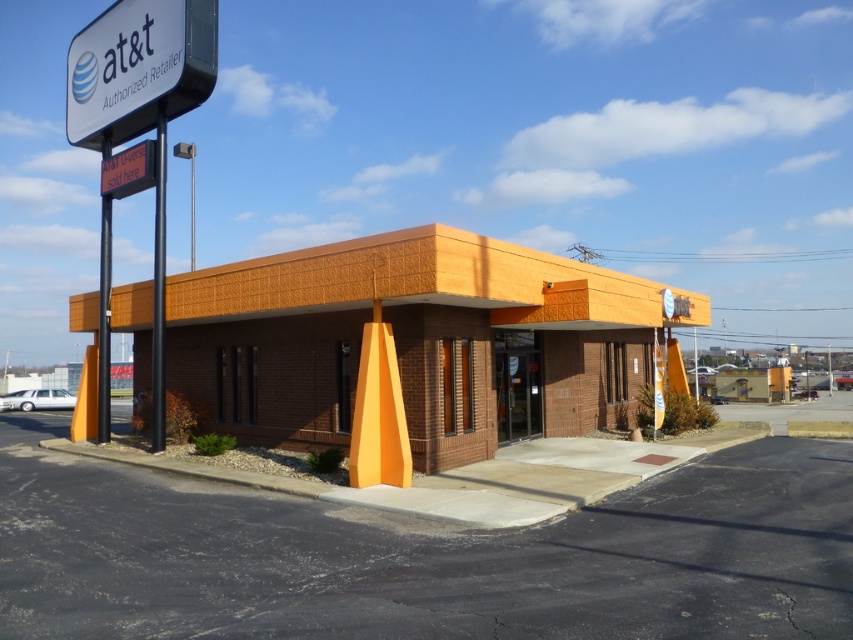
Who is lower down, orange brick motel at center or white plastic sign at upper left?

orange brick motel at center is lower down.

Is the position of orange brick motel at center more distant than that of white plastic sign at upper left?

No, it is in front of white plastic sign at upper left.

Is point (288, 337) positioned behind point (151, 74)?

Yes, point (288, 337) is farther from viewer.

Where is `orange brick motel at center`? orange brick motel at center is located at coordinates (416, 340).

Between white plastic sign at upper left and orange digital sign at upper left, which one appears on the right side from the viewer's perspective?

white plastic sign at upper left is more to the right.

Is white plastic sign at upper left above orange digital sign at upper left?

Correct, white plastic sign at upper left is located above orange digital sign at upper left.

Does point (136, 99) come behind point (115, 186)?

No, it is in front of (115, 186).

Identify the location of white plastic sign at upper left. (138, 68).

Looking at this image, does orange brick motel at center appear under orange digital sign at upper left?

Indeed, orange brick motel at center is positioned under orange digital sign at upper left.

Can you confirm if orange brick motel at center is thinner than orange digital sign at upper left?

Incorrect, orange brick motel at center's width is not less than orange digital sign at upper left's.

Who is more forward, (445, 266) or (143, 186)?

Point (445, 266) is in front.

In order to click on orange brick motel at center in this screenshot , I will do `click(416, 340)`.